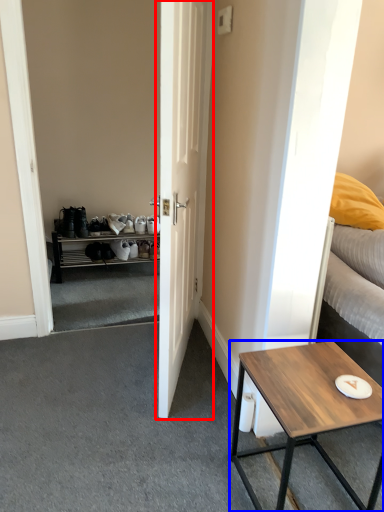
Question: Which object appears closest to the camera in this image, door (highlighted by a red box) or coffee table (highlighted by a blue box)?

Choices:
 (A) door
 (B) coffee table

Answer: (B)